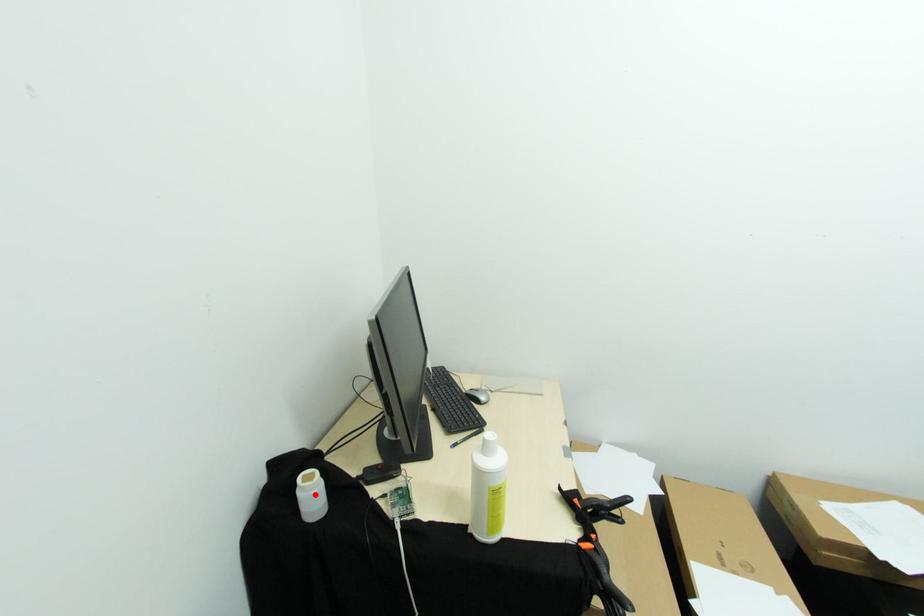
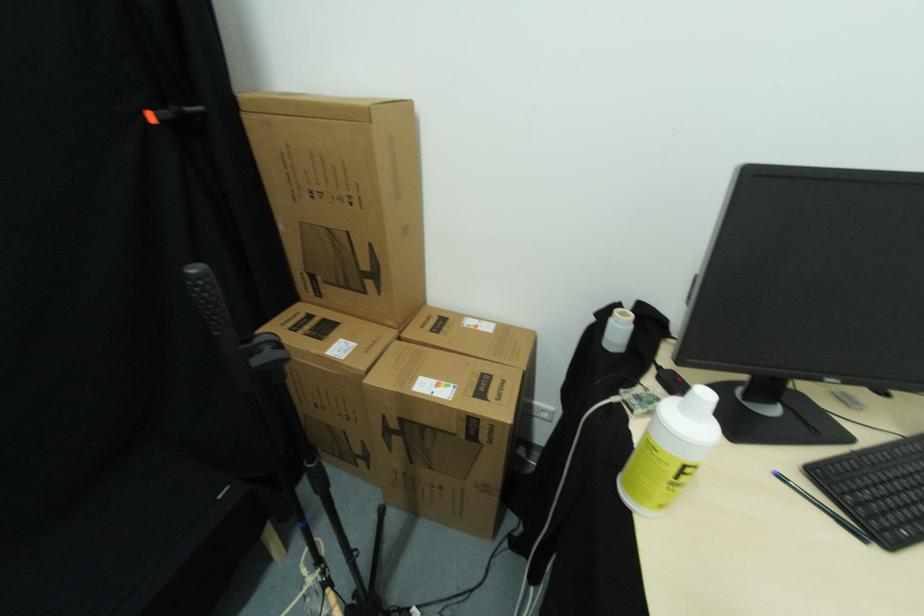
Locate, in the second image, the point that corresponds to the highlighted location in the first image.

(622, 330)